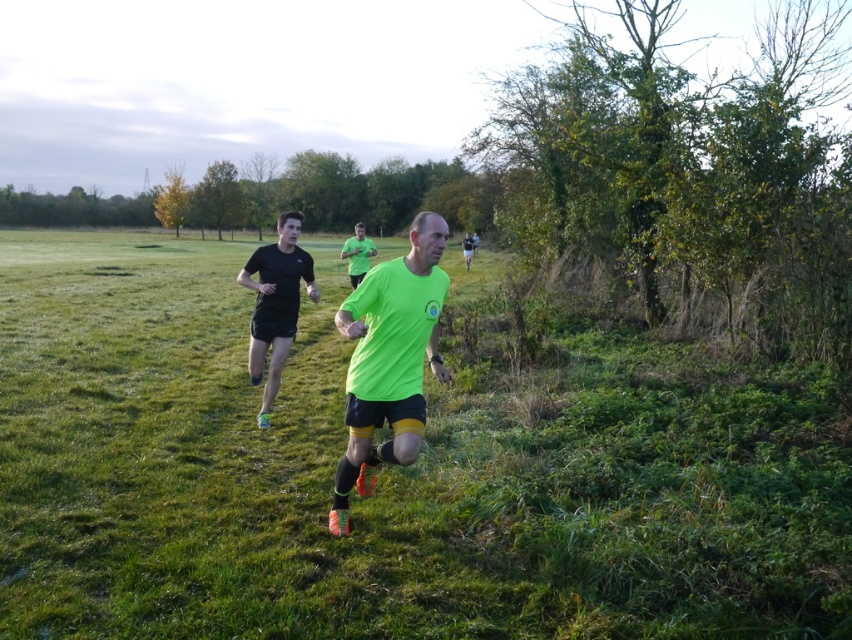
Question: Which object is farther from the camera taking this photo?

Choices:
 (A) neon green fabric at center
 (B) neon green t-shirt at center

Answer: (B)

Question: Is neon green fabric at center further to the viewer compared to matte black shorts at center?

Choices:
 (A) yes
 (B) no

Answer: (B)

Question: Where is green grass at center located in relation to neon green t-shirt at center in the image?

Choices:
 (A) right
 (B) left

Answer: (B)

Question: Is green grass at center to the right of matte black shorts at center from the viewer's perspective?

Choices:
 (A) no
 (B) yes

Answer: (A)

Question: Among these points, which one is farthest from the camera?

Choices:
 (A) (154, 602)
 (B) (357, 445)
 (C) (301, 252)

Answer: (C)

Question: Which point is farther to the camera?

Choices:
 (A) neon green t-shirt at center
 (B) green grass at center
 (C) neon green fabric at center

Answer: (A)